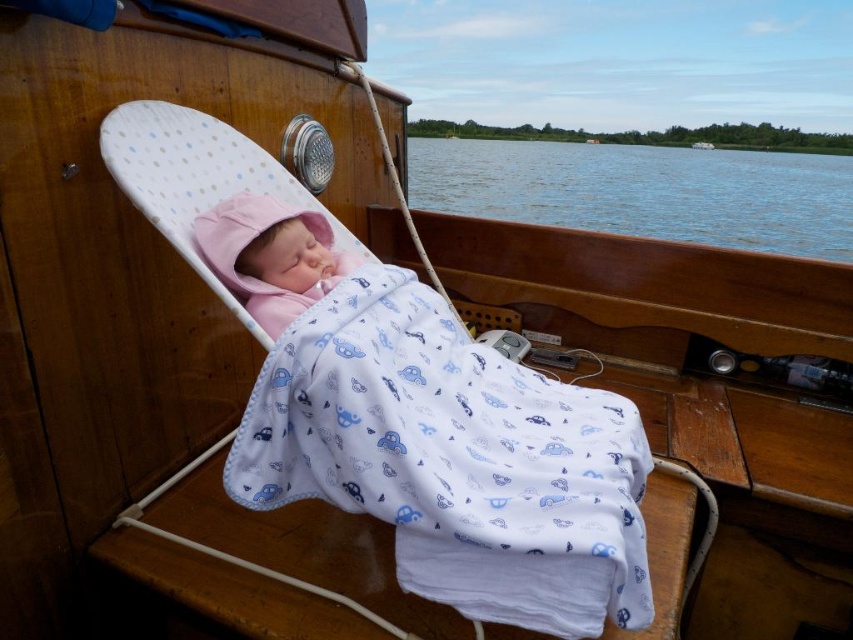
Question: Is the position of pink fleece baby at center more distant than that of wooden boat at center?

Choices:
 (A) yes
 (B) no

Answer: (B)

Question: Among these objects, which one is nearest to the camera?

Choices:
 (A) wooden boat at center
 (B) white cotton blanket at center

Answer: (B)

Question: Which of the following is the closest to the observer?

Choices:
 (A) pink fleece baby at center
 (B) white cotton blanket at center

Answer: (B)

Question: Considering the relative positions of pink fleece baby at center and wooden boat at center in the image provided, where is pink fleece baby at center located with respect to wooden boat at center?

Choices:
 (A) right
 (B) left

Answer: (B)

Question: Which object is positioned closest to the blue water at center?

Choices:
 (A) white cotton blanket at center
 (B) pink fleece baby at center
 (C) wooden boat at center

Answer: (A)

Question: Is pink fleece baby at center above wooden boat at center?

Choices:
 (A) yes
 (B) no

Answer: (B)